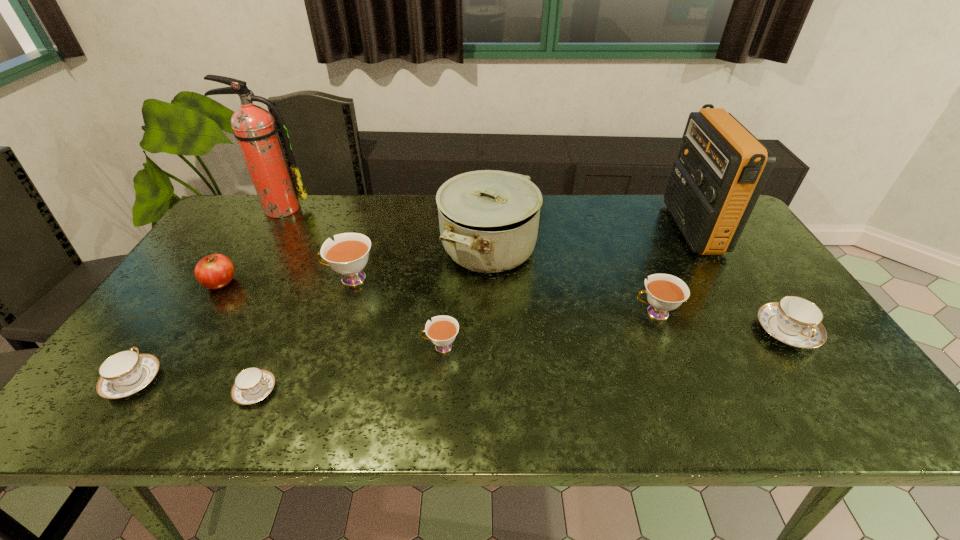
This screenshot has width=960, height=540. Identify the location of object that ranks as the fourth closest to the third object from right to left. (442, 331).

Locate which teacup ranks in proximity to the farthest white teacup. Please provide its 2D coordinates. Your answer should be formatted as a tuple, i.e. [(x, y)], where the tuple contains the x and y coordinates of a point satisfying the conditions above.

[(442, 331)]

Locate an element on the screen. The height and width of the screenshot is (540, 960). the fourth closest teacup to the radio receiver is located at coordinates (348, 255).

Where is `white teacup identified as the closest to the second nearest white teacup`? white teacup identified as the closest to the second nearest white teacup is located at coordinates (442, 331).

The width and height of the screenshot is (960, 540). Identify the location of the third closest white teacup to the second biggest blue teacup. (665, 292).

Identify which blue teacup is the nearest to the leftmost teacup. Please provide its 2D coordinates. Your answer should be formatted as a tuple, i.e. [(x, y)], where the tuple contains the x and y coordinates of a point satisfying the conditions above.

[(251, 385)]

Point out which blue teacup is positioned as the third nearest to the saucepan. Please provide its 2D coordinates. Your answer should be formatted as a tuple, i.e. [(x, y)], where the tuple contains the x and y coordinates of a point satisfying the conditions above.

[(127, 372)]